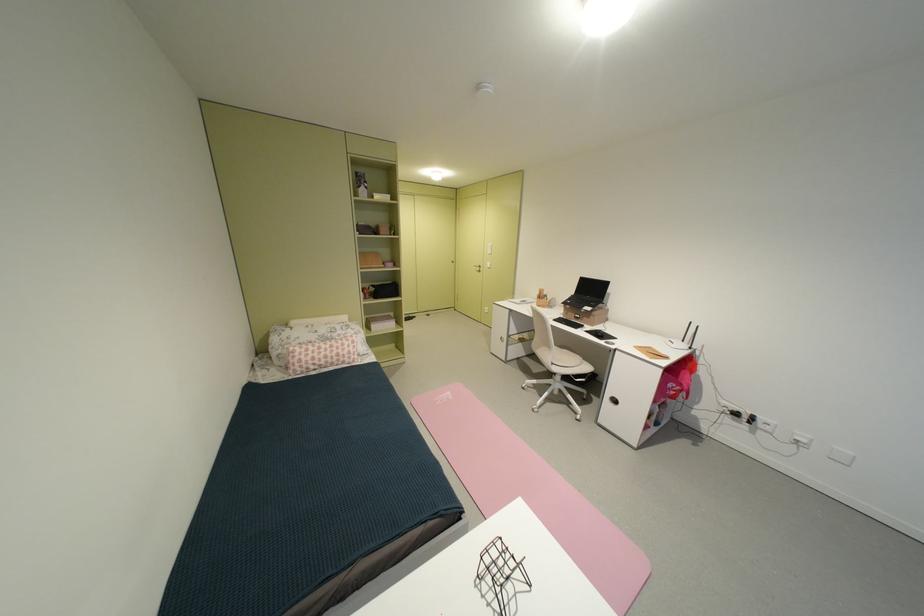
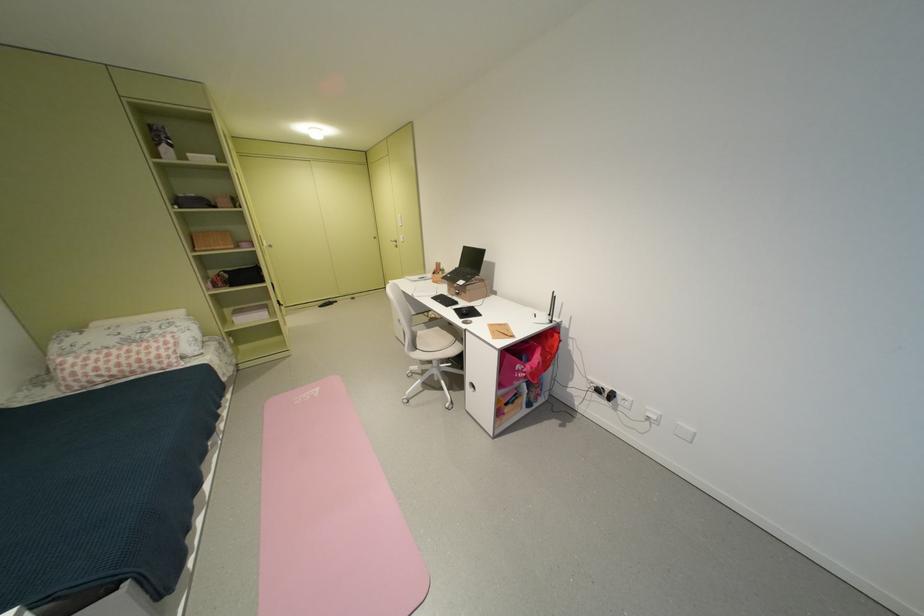
In the second image, find the point that corresponds to [446,405] in the first image.

(305, 403)